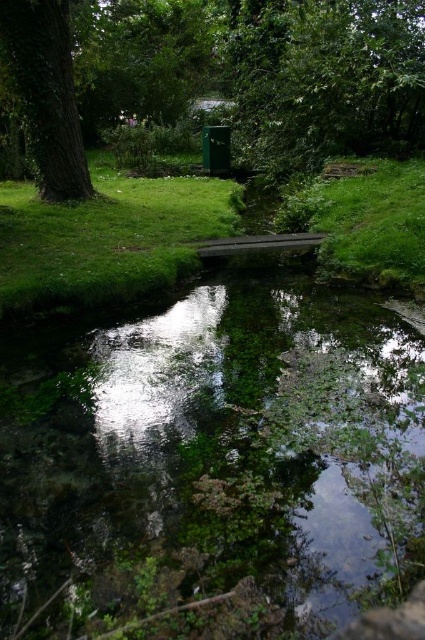
Who is taller, green mossy stream at center or green leafy tree at upper left?

Standing taller between the two is green leafy tree at upper left.

Can you confirm if green mossy stream at center is positioned above green leafy tree at upper left?

No, green mossy stream at center is not above green leafy tree at upper left.

Locate an element on the screen. Image resolution: width=425 pixels, height=640 pixels. green mossy stream at center is located at coordinates (203, 458).

Is point (14, 282) less distant than point (74, 109)?

That is True.

Which is more to the left, green grass at center or green leafy tree at left?

green leafy tree at left

Consider the image. Measure the distance between point [193,195] and camera.

Point [193,195] and camera are 10.65 meters apart from each other.

Identify the location of green grass at center. (107, 237).

Is green leafy tree at upper left to the left of green grass at center from the viewer's perspective?

Incorrect, green leafy tree at upper left is not on the left side of green grass at center.

Who is more distant from viewer, (223, 67) or (107, 198)?

Positioned behind is point (223, 67).

This screenshot has height=640, width=425. What are the coordinates of `green leafy tree at upper left` in the screenshot? It's located at (218, 72).